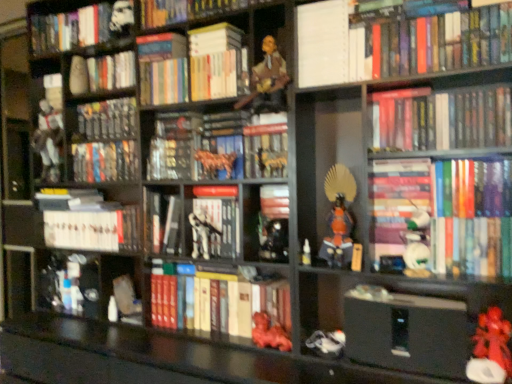
The height and width of the screenshot is (384, 512). What do you see at coordinates (306, 253) in the screenshot? I see `translucent plastic bottle at center, the 5th toy when ordered from right to left` at bounding box center [306, 253].

In order to face white glossy figurine at center-right, the second toy from the right, should I rotate leftwards or rightwards?

It's best to rotate right around 20.909 degrees.

The image size is (512, 384). In order to click on metallic silver toy at center-left, which is the 9th book from bottom to top in this screenshot , I will do `click(106, 119)`.

You are a GUI agent. You are given a task and a screenshot of the screen. Output one action in this format:
    pyautogui.click(x=<x>, y=<y>)
    Task: Click on the translucent plastic bottle at center, the 5th toy when ordered from right to left
    
    Given the screenshot: What is the action you would take?
    pyautogui.click(x=306, y=253)

Based on the photo, can white matte skeleton at center, the third toy positioned from the left, be found inside matte black figurine at center?

No.

From the image's perspective, which one is positioned higher, matte black figurine at center or white matte skeleton at center, the third toy positioned from the left?

matte black figurine at center, from the image's perspective.

Is matte black figurine at center further to camera compared to white matte skeleton at center, the third toy positioned from the left?

No.

Does matte black figurine at center appear on the left side of white matte skeleton at center, the third toy positioned from the left?

In fact, matte black figurine at center is to the right of white matte skeleton at center, the third toy positioned from the left.

From the image's perspective, which object appears higher, matte gray book at center, which is counted as the fifteenth book, starting from the top, or hardcover books at upper right, which is the eighth book in top-to-bottom order?

From the image's view, hardcover books at upper right, which is the eighth book in top-to-bottom order, is above.

Identify the location of book that is the 13th one when counting forward from the matte gray book at center, which is counted as the fifteenth book, starting from the top. (442, 119).

Looking at this image, which is more to the left, matte gray book at center, which is counted as the fifteenth book, starting from the top, or hardcover books at upper right, which is the eighth book in top-to-bottom order?

matte gray book at center, which is counted as the fifteenth book, starting from the top.

Looking at this image, can you confirm if matte gray book at center, which is counted as the fifteenth book, starting from the top, is shorter than hardcover books at upper right, positioned as the eighth book in bottom-to-top order?

No, matte gray book at center, which is counted as the fifteenth book, starting from the top, is not shorter than hardcover books at upper right, positioned as the eighth book in bottom-to-top order.

Are hardcover book at center, which appears as the 14th book when viewed from the top, and shiny black figurine at center, which ranks as the sixth toy in left-to-right order, far apart?

That's not correct — hardcover book at center, which appears as the 14th book when viewed from the top, is a little close to shiny black figurine at center, which ranks as the sixth toy in left-to-right order.

Which object is thinner, hardcover book at center, which ranks as the 2th book in bottom-to-top order, or shiny black figurine at center, marked as the sixth toy in a right-to-left arrangement?

shiny black figurine at center, marked as the sixth toy in a right-to-left arrangement.

Which is closer, (159, 307) or (265, 226)?

Point (265, 226)

Can shiny black figurine at center, which ranks as the sixth toy in left-to-right order, be found inside hardcover book at center, which appears as the 14th book when viewed from the top?

Definitely not — shiny black figurine at center, which ranks as the sixth toy in left-to-right order, is not inside hardcover book at center, which appears as the 14th book when viewed from the top.

Which point is more forward, (217, 327) or (449, 127)?

The point (449, 127) is closer.

From a real-world perspective, is hardcover book at center, which appears as the 14th book when viewed from the top, positioned over hardcover books at upper right, positioned as the eighth book in bottom-to-top order, based on gravity?

Actually, hardcover book at center, which appears as the 14th book when viewed from the top, is physically below hardcover books at upper right, positioned as the eighth book in bottom-to-top order, in the real world.

From the image's perspective, does hardcover book at center, which ranks as the 2th book in bottom-to-top order, appear lower than hardcover books at upper right, which is the eighth book in top-to-bottom order?

Correct, hardcover book at center, which ranks as the 2th book in bottom-to-top order, appears lower than hardcover books at upper right, which is the eighth book in top-to-bottom order, in the image.

This screenshot has height=384, width=512. I want to click on the 6th book above the hardcover book at center, which appears as the 14th book when viewed from the top (from a real-world perspective), so click(442, 119).

Is hardcover books at upper right, which is the eighth book in top-to-bottom order, spatially inside white matte stormtrooper at upper left, positioned as the 10th toy in right-to-left order, or outside of it?

hardcover books at upper right, which is the eighth book in top-to-bottom order, is located beyond the bounds of white matte stormtrooper at upper left, positioned as the 10th toy in right-to-left order.

Is hardcover books at upper right, which is the eighth book in top-to-bottom order, further to the viewer compared to white matte stormtrooper at upper left, positioned as the 10th toy in right-to-left order?

No, hardcover books at upper right, which is the eighth book in top-to-bottom order, is closer to the viewer.

From a real-world perspective, is hardcover books at upper right, positioned as the eighth book in bottom-to-top order, beneath white matte stormtrooper at upper left, the second toy in the left-to-right sequence?

Yes, from a real-world perspective, hardcover books at upper right, positioned as the eighth book in bottom-to-top order, is beneath white matte stormtrooper at upper left, the second toy in the left-to-right sequence.

Considering the positions of objects wooden figure at upper center and hardcover books at upper right, the fifth book from the top, in the image provided, who is more to the right, wooden figure at upper center or hardcover books at upper right, the fifth book from the top,?

hardcover books at upper right, the fifth book from the top, is more to the right.

Is wooden figure at upper center outside of hardcover books at upper right, which is the 11th book in bottom-to-top order?

Indeed, wooden figure at upper center is completely outside hardcover books at upper right, which is the 11th book in bottom-to-top order.

Which object is wider, wooden figure at upper center or hardcover books at upper right, which is the 11th book in bottom-to-top order?

wooden figure at upper center is wider.

Identify the location of person located below the hardcover books at upper right, which is the 11th book in bottom-to-top order (from the image's perspective). (267, 77).

Is metallic gold figurine at center, the 4th toy in the left-to-right sequence, aimed at shiny black figurine at center, marked as the sixth toy in a right-to-left arrangement?

No, metallic gold figurine at center, the 4th toy in the left-to-right sequence, does not turn towards shiny black figurine at center, marked as the sixth toy in a right-to-left arrangement.

Which of these two, metallic gold figurine at center, the 8th toy in the right-to-left sequence, or shiny black figurine at center, marked as the sixth toy in a right-to-left arrangement, is thinner?

metallic gold figurine at center, the 8th toy in the right-to-left sequence.

Which is in front, metallic gold figurine at center, the 8th toy in the right-to-left sequence, or shiny black figurine at center, marked as the sixth toy in a right-to-left arrangement?

shiny black figurine at center, marked as the sixth toy in a right-to-left arrangement, is in front.

Looking at this image, would you say metallic gold figurine at center, the 4th toy in the left-to-right sequence, contains shiny black figurine at center, marked as the sixth toy in a right-to-left arrangement?

No, shiny black figurine at center, marked as the sixth toy in a right-to-left arrangement, is located outside of metallic gold figurine at center, the 4th toy in the left-to-right sequence.

The width and height of the screenshot is (512, 384). I want to click on the 2nd toy below the matte black figurine at center (from the image's perspective), so click(x=201, y=233).

This screenshot has height=384, width=512. I want to click on the 9th book to the right of the matte gray book at center, which is counted as the fifteenth book, starting from the top, starting your count from the anchor, so click(442, 119).

Estimate the real-world distances between objects in this image. Which object is further from hardcover books at upper center, acting as the 10th book starting from the bottom, orange matte samurai armor at center, marked as the 9th toy in a left-to-right arrangement, or hardcover book at center, which appears as the 14th book when viewed from the top?

The object further to hardcover books at upper center, acting as the 10th book starting from the bottom, is hardcover book at center, which appears as the 14th book when viewed from the top.

Looking at the image, which one is located further to white glossy figurine at center-right, the second toy from the right, white matte toy at center, placed as the eighth toy when sorted from left to right, or hardcover book at center, which appears as the 14th book when viewed from the top?

hardcover book at center, which appears as the 14th book when viewed from the top, is positioned further to the anchor white glossy figurine at center-right, the second toy from the right.

When comparing their distances from hardcover books at upper right, which is the 11th book in bottom-to-top order, does hardcover books at upper center, acting as the 10th book starting from the bottom, or white matte toy at center, the fourth toy viewed from the right, seem closer?

hardcover books at upper center, acting as the 10th book starting from the bottom, is positioned closer to the anchor hardcover books at upper right, which is the 11th book in bottom-to-top order.

When comparing their distances from hardcover books at upper right, which is the eighth book in top-to-bottom order, does white matte armor at left, marked as the 11th toy in a right-to-left arrangement, or white glossy figurine at center-right, which is counted as the tenth toy, starting from the left, seem further?

Among the two, white matte armor at left, marked as the 11th toy in a right-to-left arrangement, is located further to hardcover books at upper right, which is the eighth book in top-to-bottom order.

Estimate the real-world distances between objects in this image. Which object is closer to hardcover book at center-left, positioned as the 9th book in top-to-bottom order, white matte armor at left, marked as the first toy in a left-to-right arrangement, or matte black figurine at center?

Among the two, white matte armor at left, marked as the first toy in a left-to-right arrangement, is located nearer to hardcover book at center-left, positioned as the 9th book in top-to-bottom order.

Based on their spatial positions, is matte red statue at lower center, which ranks as the 7th toy in right-to-left order, or hardcover book at center, which ranks as the fourteenth book in bottom-to-top order, closer to wooden figure at upper center?

Based on the image, hardcover book at center, which ranks as the fourteenth book in bottom-to-top order, appears to be nearer to wooden figure at upper center.

Which object lies further to the anchor point hardcover books at upper right, positioned as the eighth book in bottom-to-top order, hardcover book at center right, the tenth book positioned from the top, or orange matte samurai armor at center, which is the third toy in right-to-left order?

Based on the image, orange matte samurai armor at center, which is the third toy in right-to-left order, appears to be further to hardcover books at upper right, positioned as the eighth book in bottom-to-top order.

Based on their spatial positions, is white matte stormtrooper at upper left, the second toy in the left-to-right sequence, or white glossy book at center, marked as the 12th book in a top-to-bottom arrangement, closer to metallic silver toy at center-left, which is the 9th book from bottom to top?

white matte stormtrooper at upper left, the second toy in the left-to-right sequence, is closer to metallic silver toy at center-left, which is the 9th book from bottom to top.

You are a GUI agent. You are given a task and a screenshot of the screen. Output one action in this format:
    pyautogui.click(x=<x>, y=<y>)
    Task: Click on the person between white matte book at upper left, which is the 13th book from bottom to top, and white glossy figurine at center-right, which is counted as the tenth toy, starting from the left
    The image size is (512, 384).
    Given the screenshot: What is the action you would take?
    pyautogui.click(x=267, y=77)

Identify the location of person between white matte book at center, which appears as the thirteenth book when viewed from the top, and hardcover books at upper right, which is the eighth book in top-to-bottom order. (267, 77).

Where is `person situated between hardcover book at center-left, the 7th book ordered from the bottom, and hardcover book at center right, the tenth book positioned from the top, from left to right`? person situated between hardcover book at center-left, the 7th book ordered from the bottom, and hardcover book at center right, the tenth book positioned from the top, from left to right is located at coordinates pos(267,77).

The width and height of the screenshot is (512, 384). What are the coordinates of `cabinet between hardcover books at upper right, which is the eighth book in top-to-bottom order, and rubberized red toy at lower right, the first toy in the right-to-left sequence, from top to bottom` in the screenshot? It's located at (265, 223).